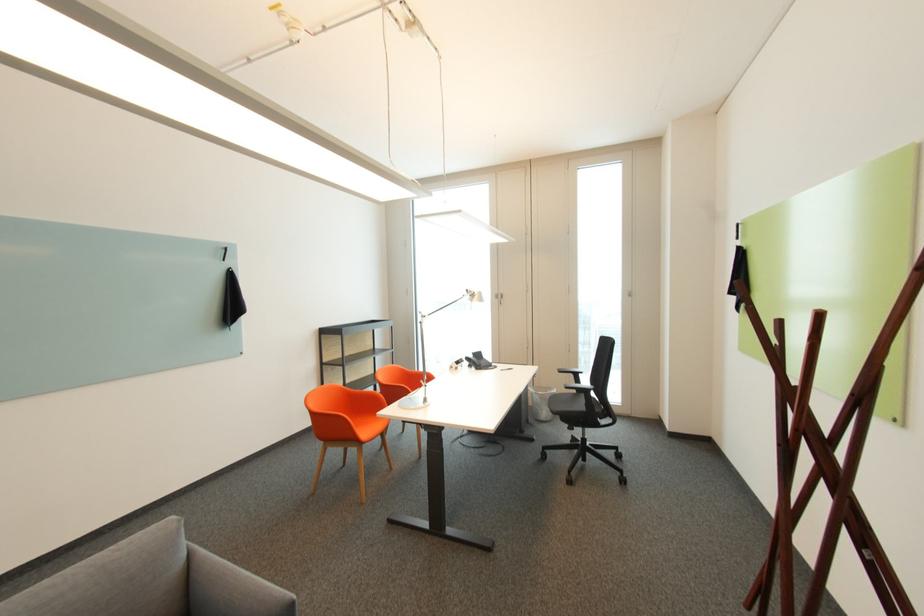
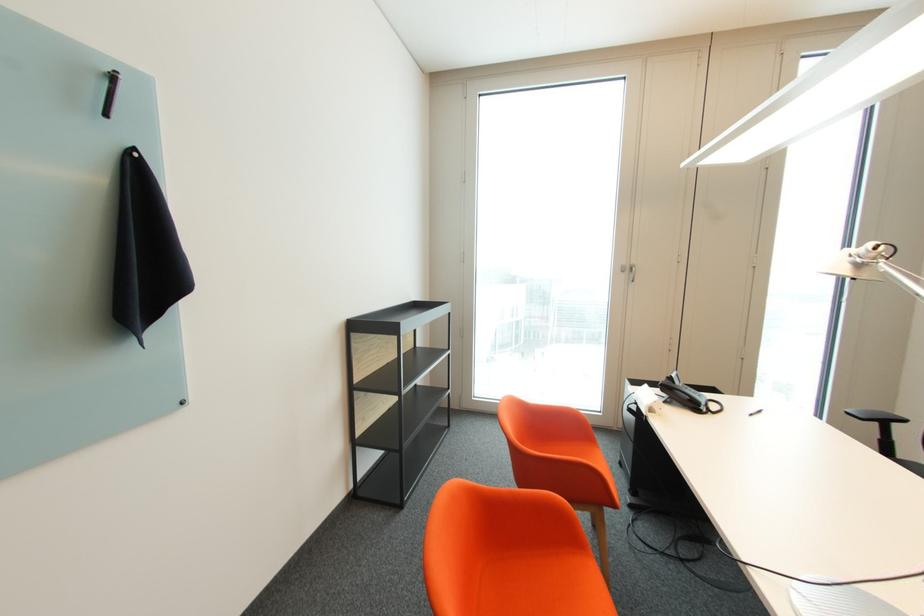
The point at (504, 299) is marked in the first image. Where is the corresponding point in the second image?

(629, 272)